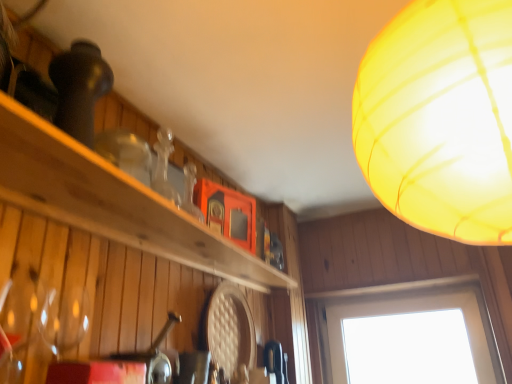
Question: Is translucent yellow lampshade at upper right thinner than transparent glass window at lower right?

Choices:
 (A) no
 (B) yes

Answer: (A)

Question: Is translucent yellow lampshade at upper right at the left side of transparent glass window at lower right?

Choices:
 (A) no
 (B) yes

Answer: (B)

Question: Is translucent yellow lampshade at upper right to the right of transparent glass window at lower right from the viewer's perspective?

Choices:
 (A) no
 (B) yes

Answer: (A)

Question: Considering the relative positions of translucent yellow lampshade at upper right and transparent glass window at lower right in the image provided, is translucent yellow lampshade at upper right behind transparent glass window at lower right?

Choices:
 (A) no
 (B) yes

Answer: (A)

Question: Considering the relative sizes of translucent yellow lampshade at upper right and transparent glass window at lower right in the image provided, is translucent yellow lampshade at upper right shorter than transparent glass window at lower right?

Choices:
 (A) no
 (B) yes

Answer: (A)

Question: Looking at the image, does translucent yellow lampshade at upper right seem bigger or smaller compared to transparent glass window at lower right?

Choices:
 (A) big
 (B) small

Answer: (A)

Question: Is translucent yellow lampshade at upper right spatially inside transparent glass window at lower right, or outside of it?

Choices:
 (A) outside
 (B) inside

Answer: (A)

Question: Considering the positions of translucent yellow lampshade at upper right and transparent glass window at lower right in the image, is translucent yellow lampshade at upper right taller or shorter than transparent glass window at lower right?

Choices:
 (A) tall
 (B) short

Answer: (A)

Question: Is translucent yellow lampshade at upper right wider or thinner than transparent glass window at lower right?

Choices:
 (A) thin
 (B) wide

Answer: (B)

Question: Is wooden shelf at upper left in front of or behind transparent glass window at lower right in the image?

Choices:
 (A) front
 (B) behind

Answer: (A)

Question: In the image, is wooden shelf at upper left on the left side or the right side of transparent glass window at lower right?

Choices:
 (A) left
 (B) right

Answer: (A)

Question: From the image's perspective, is wooden shelf at upper left above or below transparent glass window at lower right?

Choices:
 (A) below
 (B) above

Answer: (B)

Question: From a real-world perspective, is wooden shelf at upper left positioned above or below transparent glass window at lower right?

Choices:
 (A) above
 (B) below

Answer: (A)

Question: Based on their sizes in the image, would you say translucent yellow lampshade at upper right is bigger or smaller than wooden shelf at upper left?

Choices:
 (A) small
 (B) big

Answer: (B)

Question: Would you say translucent yellow lampshade at upper right is to the left or to the right of wooden shelf at upper left in the picture?

Choices:
 (A) right
 (B) left

Answer: (A)